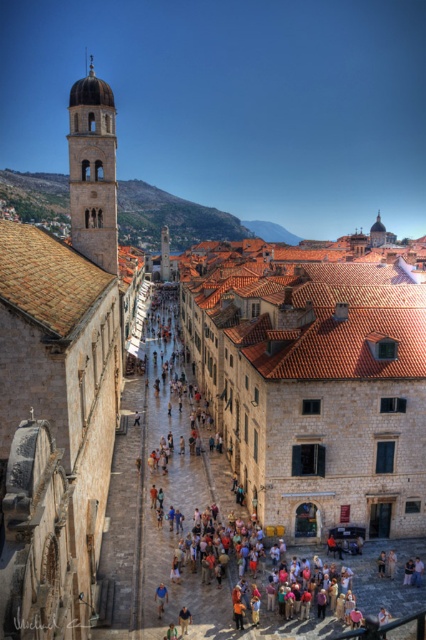
You are a tourist standing on the street in Dubrovnik and you see a person wearing a blue fabric shirt at center and another person wearing a light brown leather jacket at center. Which person is closer to you?

The blue fabric shirt at center is closer to you because it is further to the viewer than the light brown leather jacket at center.

Based on the photo, you are standing on the cobblestone street in Dubrovnik and want to take a photo of the matte stone tower at upper left. If your camera can focus up to 90 meters, will it be able to capture the tower clearly?

The matte stone tower at upper left is 89.90 meters away from the viewer, which is within the camera focus range of 90 meters. Therefore, the camera should be able to capture the tower clearly.